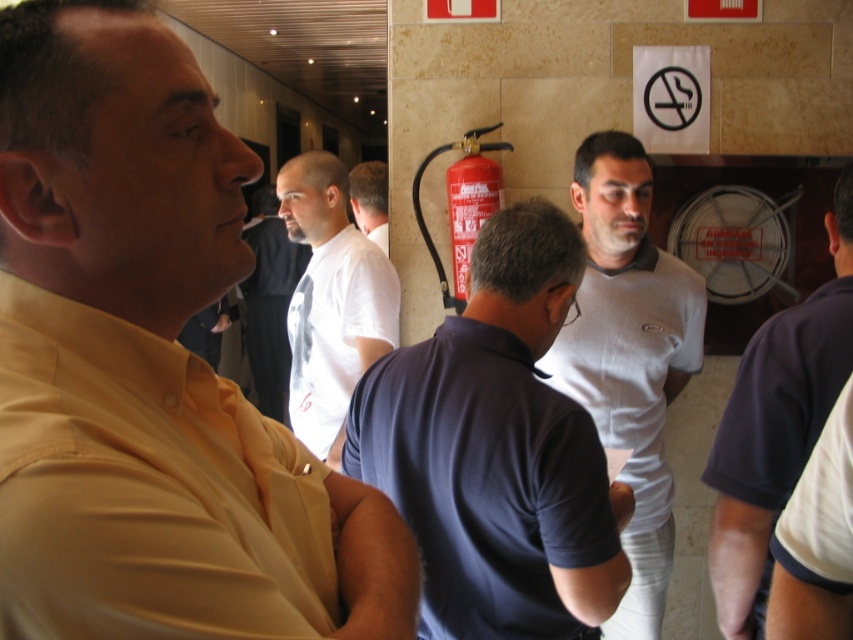
Question: Considering the relative positions of dark blue polo shirt at center and dark blue fabric shirt at right in the image provided, where is dark blue polo shirt at center located with respect to dark blue fabric shirt at right?

Choices:
 (A) above
 (B) below

Answer: (B)

Question: Estimate the real-world distances between objects in this image. Which object is farther from the white matte shirt at center?

Choices:
 (A) matte yellow shirt at center
 (B) red matte fire extinguisher at center

Answer: (A)

Question: Does gray cotton shirt at center appear under white cotton shirt at center?

Choices:
 (A) no
 (B) yes

Answer: (B)

Question: Estimate the real-world distances between objects in this image. Which object is farther from the dark blue polo shirt at center?

Choices:
 (A) white shirt at center
 (B) matte yellow shirt at center
 (C) dark blue fabric shirt at right

Answer: (A)

Question: Which point is closer to the camera?

Choices:
 (A) (364, 250)
 (B) (57, 125)
 (C) (416, 173)
 (D) (384, 195)

Answer: (B)

Question: Does dark blue polo shirt at center appear over white matte shirt at center?

Choices:
 (A) yes
 (B) no

Answer: (B)